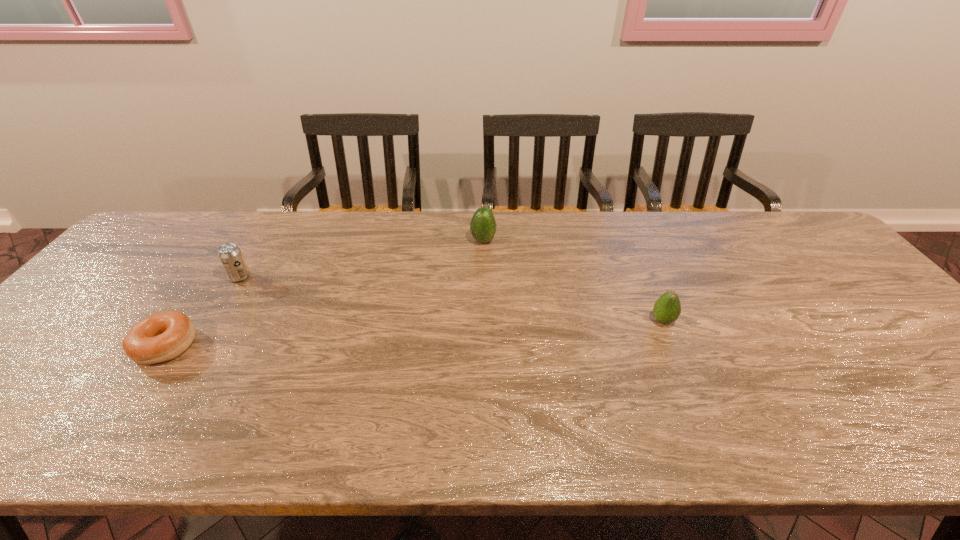
Locate an element on the screen. the second object from right to left is located at coordinates (483, 226).

At what (x,y) coordinates should I click in order to perform the action: click on the taller avocado. Please return your answer as a coordinate pair (x, y). This screenshot has width=960, height=540. Looking at the image, I should click on 483,226.

Identify the location of beer can. This screenshot has width=960, height=540. (230, 255).

The image size is (960, 540). Identify the location of the rightmost object. (667, 308).

Find the location of `the shorter avocado`. the shorter avocado is located at coordinates (667, 308).

Find the location of a particular element. The width and height of the screenshot is (960, 540). bagel is located at coordinates (162, 336).

Where is `vacant space located on the front of the farthest object`? The image size is (960, 540). vacant space located on the front of the farthest object is located at coordinates 484,285.

Identify the location of vacant space positioned 0.370m on the front of the beer can. (165, 397).

The image size is (960, 540). I want to click on vacant point located 0.280m on the back of the shorter avocado, so click(x=631, y=247).

The height and width of the screenshot is (540, 960). In order to click on free space located 0.130m on the front of the bagel in this screenshot , I will do `click(113, 421)`.